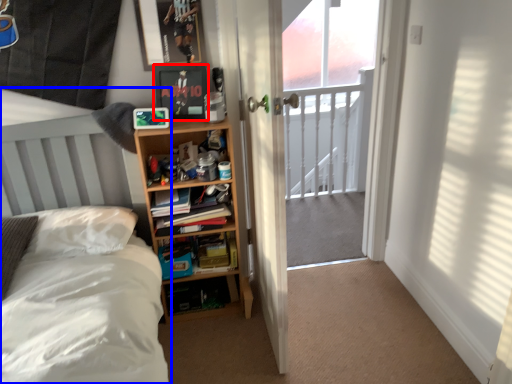
Question: Which point is further to the camera, picture frame (highlighted by a red box) or bed (highlighted by a blue box)?

Choices:
 (A) picture frame
 (B) bed

Answer: (A)